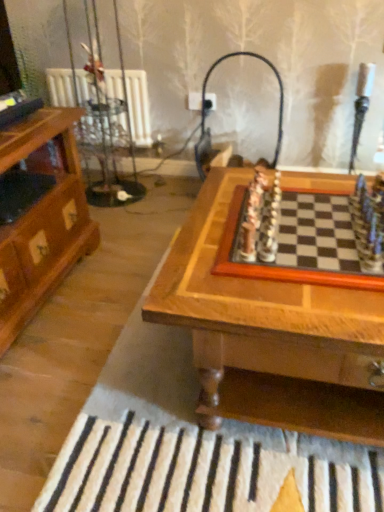
I want to click on vacant area on top of wooden chessboard at center (from a real-world perspective), so click(301, 232).